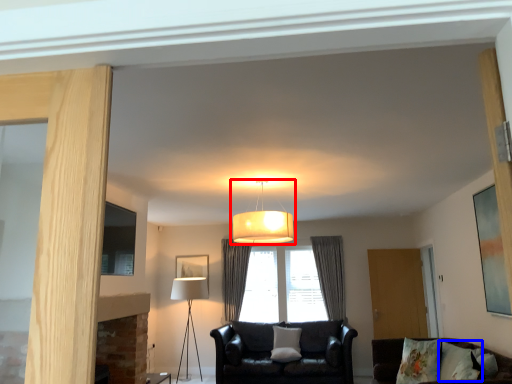
Question: Which object is closer to the camera taking this photo, lamp (highlighted by a red box) or pillow (highlighted by a blue box)?

Choices:
 (A) lamp
 (B) pillow

Answer: (B)